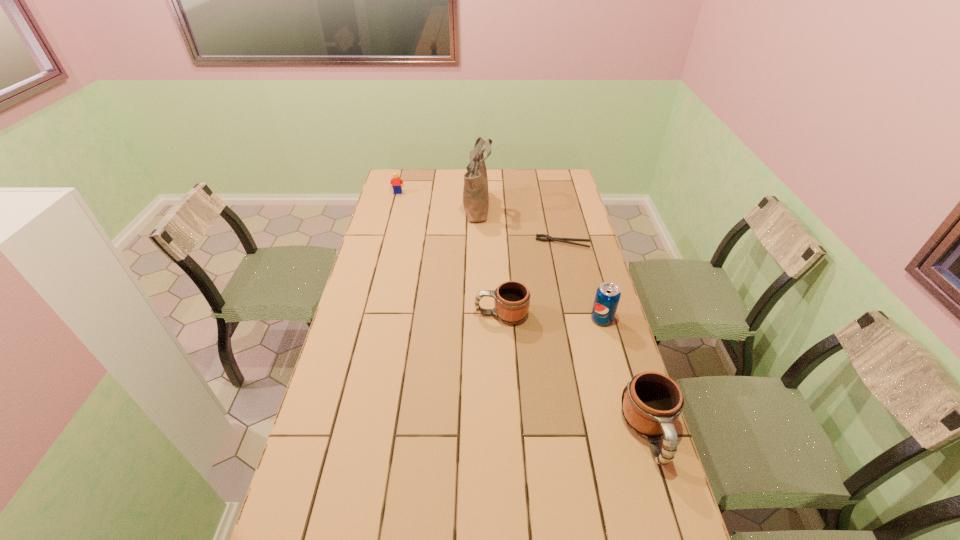
With all mugs evenly spaced, where should an extra mug be placed on the left to continue the pattern? Please point out a vacant space. Please provide its 2D coordinates. Your answer should be formatted as a tuple, i.e. [(x, y)], where the tuple contains the x and y coordinates of a point satisfying the conditions above.

[(406, 238)]